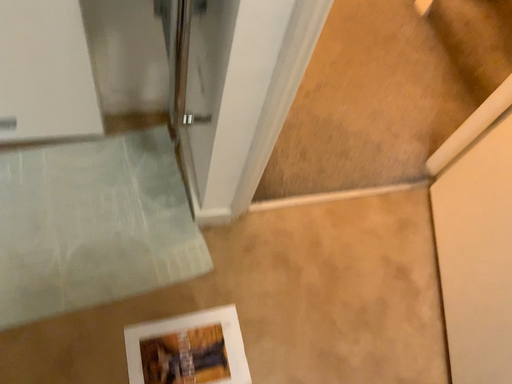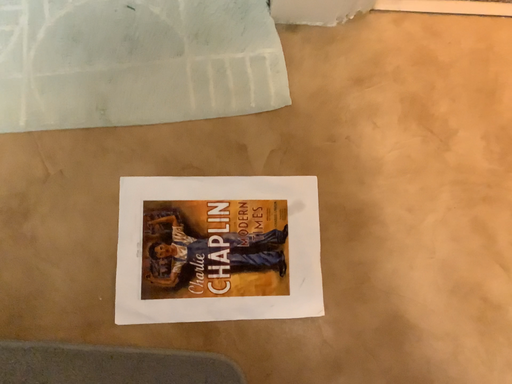
Question: How did the camera likely rotate when shooting the video?

Choices:
 (A) rotated left
 (B) rotated right

Answer: (A)